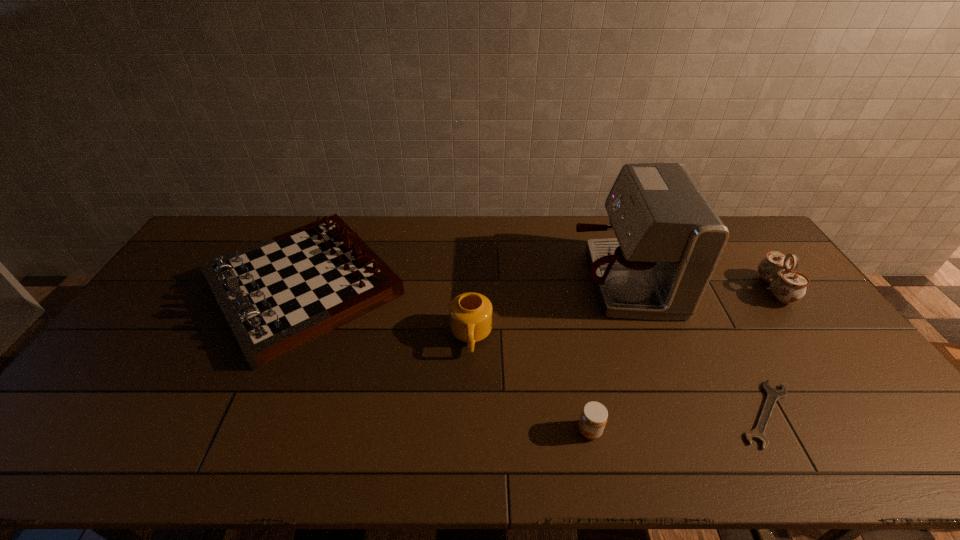
Locate an element on the screen. The height and width of the screenshot is (540, 960). vacant space at the far right corner of the desktop is located at coordinates (730, 226).

Locate an element on the screen. free space that is in between the coffee maker and the fifth object from right to left is located at coordinates (546, 308).

Find the location of `free area in between the gameboard and the second object from left to right`. free area in between the gameboard and the second object from left to right is located at coordinates (387, 311).

You are a GUI agent. You are given a task and a screenshot of the screen. Output one action in this format:
    pyautogui.click(x=<x>, y=<y>)
    Task: Click on the vacant space that is in between the gameboard and the fourth object from right to left
    This screenshot has width=960, height=540.
    Given the screenshot: What is the action you would take?
    pyautogui.click(x=446, y=358)

At what (x,y) coordinates should I click in order to perform the action: click on empty space between the gameboard and the shortest object. Please return your answer as a coordinate pair (x, y). This screenshot has height=540, width=960. Looking at the image, I should click on (535, 350).

Find the location of a particular element. blank region between the chinaware and the wrench is located at coordinates (770, 352).

Where is `empty space between the gameboard and the tallest object`? The image size is (960, 540). empty space between the gameboard and the tallest object is located at coordinates (463, 283).

This screenshot has height=540, width=960. I want to click on free space that is in between the shortest object and the fifth object from right to left, so click(618, 375).

The width and height of the screenshot is (960, 540). Identify the location of free space between the coffee maker and the fourth object from right to left. (606, 355).

Identify the location of object that stands as the second closest to the fifth object from right to left. The width and height of the screenshot is (960, 540). (594, 415).